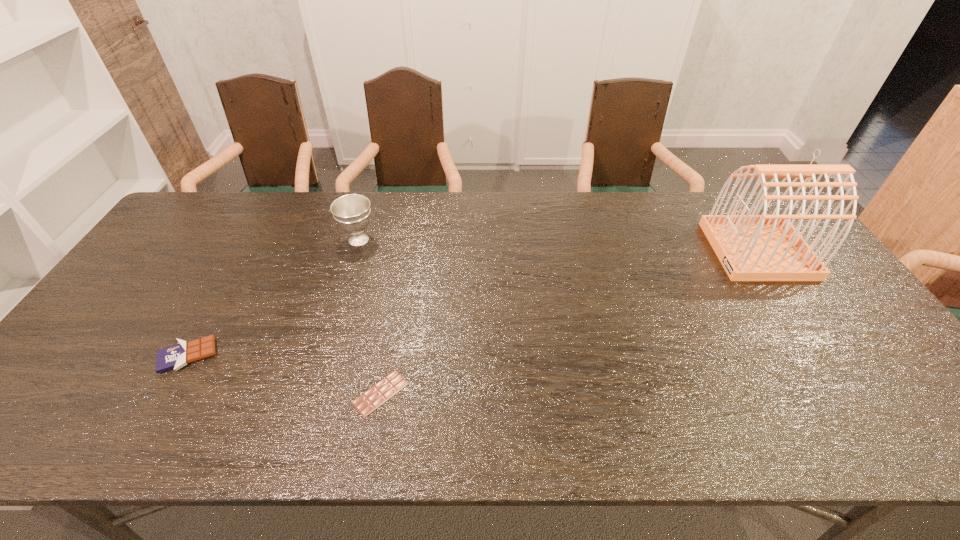
The width and height of the screenshot is (960, 540). I want to click on vacant area located with an open door on the tallest object, so click(611, 250).

This screenshot has width=960, height=540. I want to click on free space located on the right of the second tallest object, so pyautogui.click(x=493, y=240).

Identify the location of vacant region located 0.260m on the right of the taller chocolate bar. Image resolution: width=960 pixels, height=540 pixels. (322, 355).

At what (x,y) coordinates should I click in order to perform the action: click on free space located 0.260m on the left of the shortest object. Please return your answer as a coordinate pair (x, y). The height and width of the screenshot is (540, 960). Looking at the image, I should click on (240, 393).

Locate an element on the screen. This screenshot has width=960, height=540. birdcage that is at the far edge is located at coordinates (752, 247).

Locate an element on the screen. The image size is (960, 540). chalice located at the far edge is located at coordinates (352, 212).

The image size is (960, 540). What are the coordinates of `object located in the near edge section of the desktop` in the screenshot? It's located at (366, 403).

Identify the location of object located in the right edge section of the desktop. (752, 247).

Where is `object at the far right corner`? This screenshot has width=960, height=540. object at the far right corner is located at coordinates (752, 247).

The height and width of the screenshot is (540, 960). I want to click on free space at the far edge of the desktop, so click(x=602, y=196).